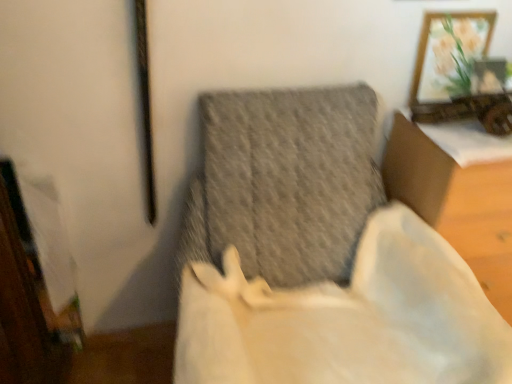
Question: Considering the positions of point (445, 21) and point (352, 317), is point (445, 21) closer or farther from the camera than point (352, 317)?

Choices:
 (A) closer
 (B) farther

Answer: (B)

Question: Is wooden framed artwork at upper right inside the boundaries of textured gray cushion at center, the second furniture viewed from the right, or outside?

Choices:
 (A) outside
 (B) inside

Answer: (A)

Question: Considering the real-world distances, which object is farthest from the white fabric cushion at center, acting as the second furniture starting from the left?

Choices:
 (A) textured gray cushion at center, the first furniture from the left
 (B) wooden framed artwork at upper right

Answer: (A)

Question: Which of these objects is positioned farthest from the wooden framed artwork at upper right?

Choices:
 (A) textured gray cushion at center, the second furniture viewed from the right
 (B) white fabric cushion at center, acting as the second furniture starting from the left

Answer: (A)